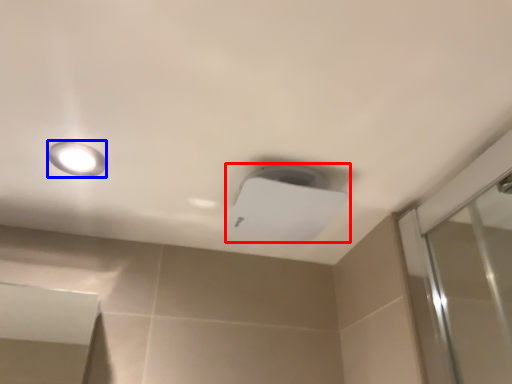
Question: Which point is closer to the camera, lamp (highlighted by a red box) or droplight (highlighted by a blue box)?

Choices:
 (A) lamp
 (B) droplight

Answer: (B)